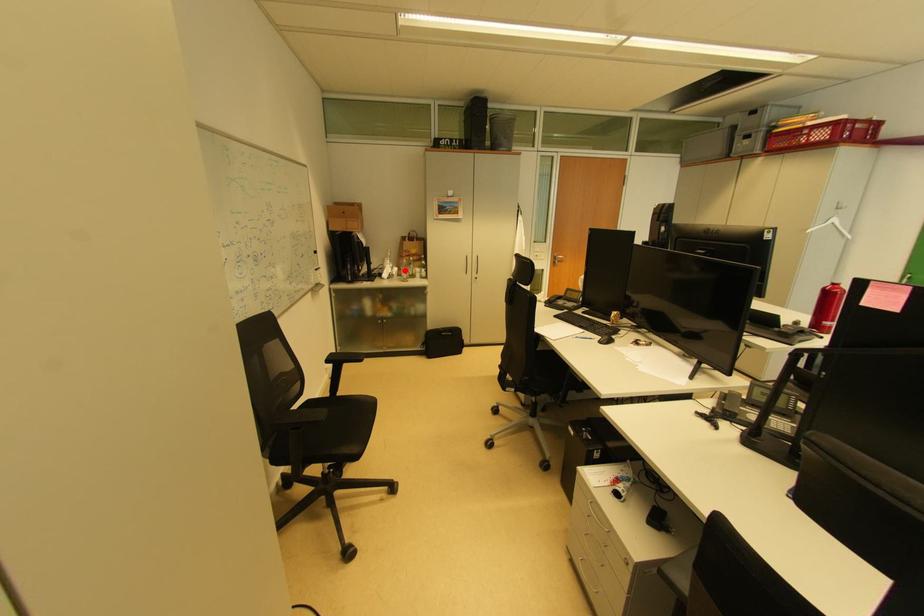
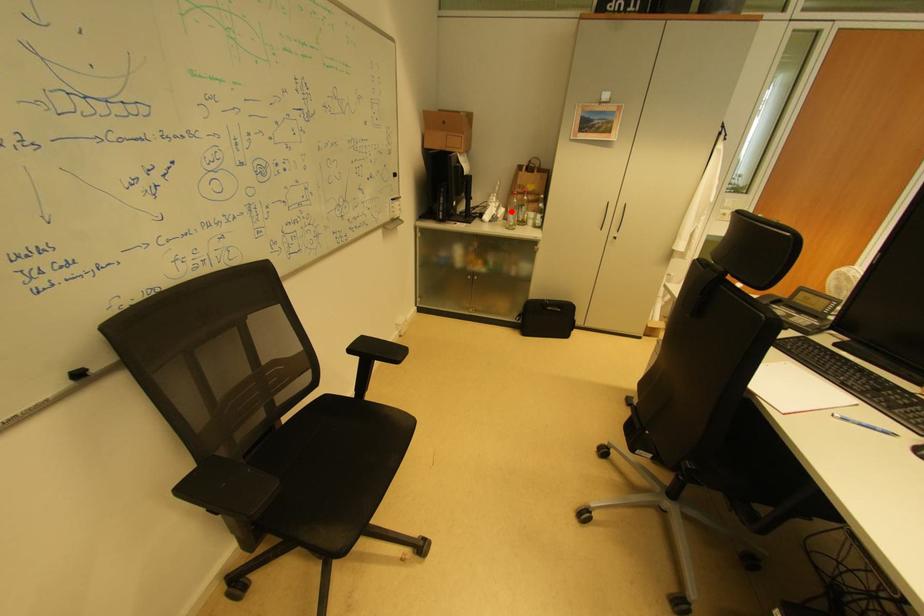
I am providing you with two images of the same scene from different viewpoints. A red point is marked on the first image and another point is marked on the second image. Do the highlighted points in image1 and image2 indicate the same real-world spot?

Yes